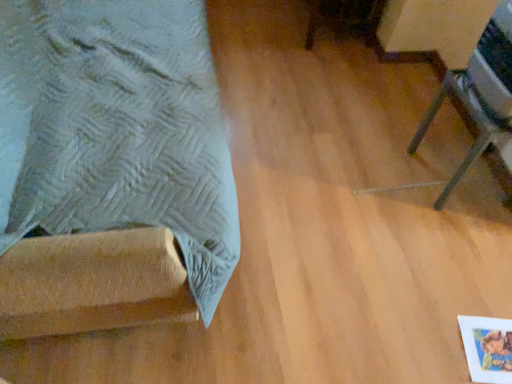
Locate an element on the screen. The height and width of the screenshot is (384, 512). vacant region below metallic silver tripod at right, the second furniture positioned from the left (from a real-world perspective) is located at coordinates (460, 179).